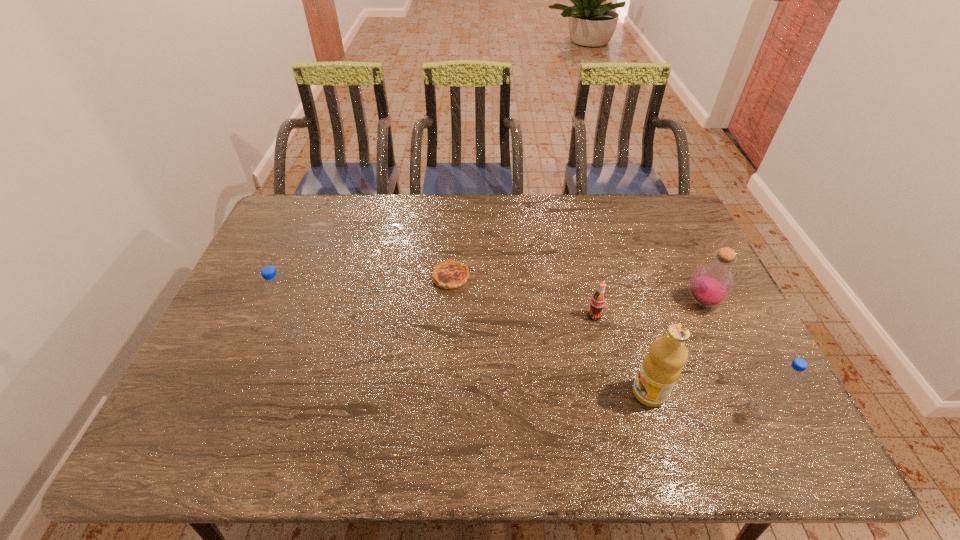
Identify the location of the fourth farthest object. (283, 305).

The image size is (960, 540). I want to click on the leftmost object, so click(283, 305).

Identify the location of the shorter water bottle. The height and width of the screenshot is (540, 960). (784, 382).

Find the location of `the right water bottle`. the right water bottle is located at coordinates (784, 382).

This screenshot has height=540, width=960. In order to click on the shortest object in this screenshot , I will do 448,274.

In order to click on the second object from left to right in this screenshot , I will do `click(448, 274)`.

Where is `bottle`? The image size is (960, 540). bottle is located at coordinates (711, 284).

Find the location of a particular element. the third object from left to right is located at coordinates (597, 303).

The width and height of the screenshot is (960, 540). I want to click on soda, so click(x=597, y=303).

Locate an element on the screen. This screenshot has width=960, height=540. olive oil is located at coordinates pyautogui.click(x=661, y=368).